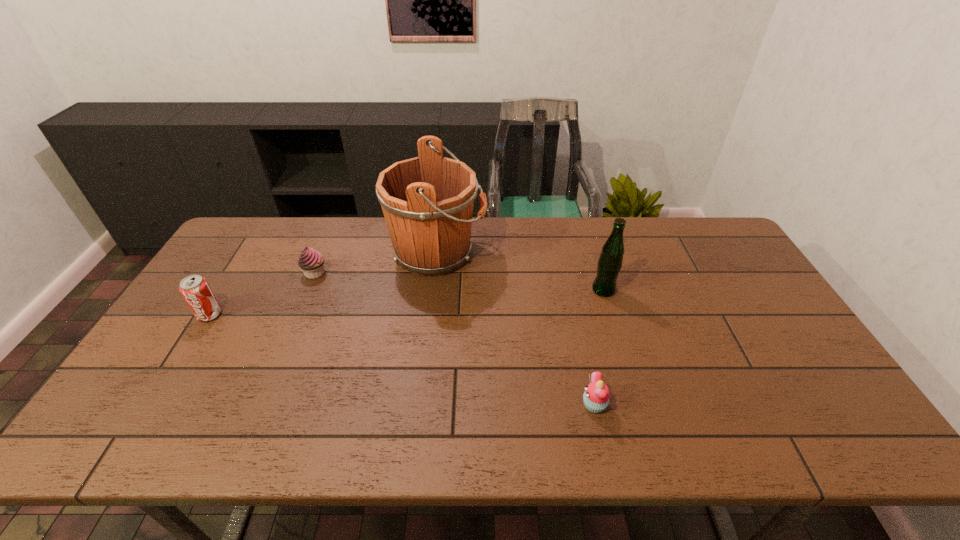
This screenshot has height=540, width=960. I want to click on bucket, so click(427, 201).

The height and width of the screenshot is (540, 960). In order to click on the third object from right to left in this screenshot , I will do `click(427, 201)`.

Where is `the rightmost object`? This screenshot has height=540, width=960. the rightmost object is located at coordinates (610, 261).

Locate an element on the screen. The height and width of the screenshot is (540, 960). the second tallest object is located at coordinates (610, 261).

This screenshot has width=960, height=540. What are the coordinates of `soda can` in the screenshot? It's located at (195, 289).

Image resolution: width=960 pixels, height=540 pixels. In order to click on the second nearest object in this screenshot , I will do `click(195, 289)`.

The image size is (960, 540). I want to click on the fourth object from right to left, so click(x=311, y=261).

Where is `the farther cupcake`? The height and width of the screenshot is (540, 960). the farther cupcake is located at coordinates (311, 261).

You are a GUI agent. You are given a task and a screenshot of the screen. Output one action in this format:
    pyautogui.click(x=<x>, y=<y>)
    Task: Click on the nearer cupcake
    
    Given the screenshot: What is the action you would take?
    pyautogui.click(x=596, y=397)

Locate an element on the screen. the nearest object is located at coordinates (596, 397).